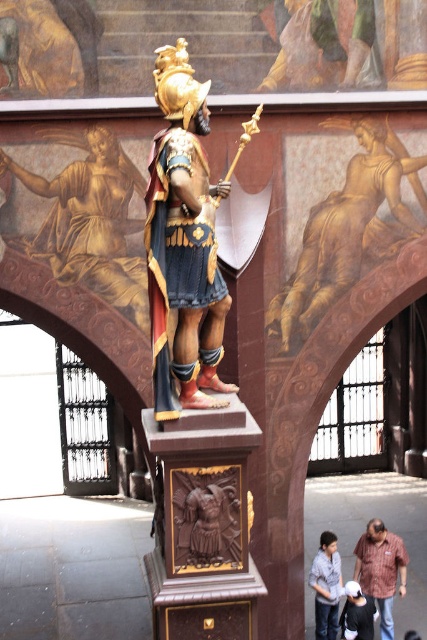
Is point (52, 179) closer to camera compared to point (318, 637)?

Yes, it is.

Is gold metallic statue at upper left thinner than denim jacket at lower right?

No.

Locate an element on the screen. gold metallic statue at upper left is located at coordinates (90, 220).

Between brown striped shirt at lower right and denim jacket at lower right, which one has more height?

brown striped shirt at lower right is taller.

Between point (377, 602) and point (318, 566), which one is positioned behind?

Point (377, 602)

Between point (400, 561) and point (330, 625), which one is positioned in front?

Point (400, 561) is more forward.

At what (x,y) coordinates should I click in order to perform the action: click on brown striped shirt at lower right. Please return your answer as a coordinate pair (x, y). Looking at the image, I should click on (380, 570).

Does gold textured armor at upper center have a greater width compared to denim jacket at lower right?

Indeed, gold textured armor at upper center has a greater width compared to denim jacket at lower right.

Who is positioned more to the right, gold textured armor at upper center or denim jacket at lower right?

gold textured armor at upper center

Locate an element on the screen. This screenshot has height=640, width=427. gold textured armor at upper center is located at coordinates (342, 220).